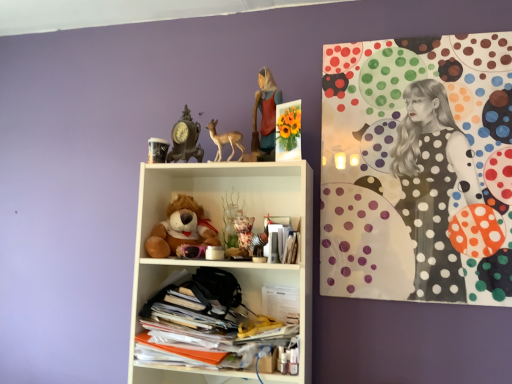
Consider the image. In order to face white paper at center, should I rotate leftwards or rightwards?

It's best to rotate right around 3.828 degrees.

Describe the element at coordinates (281, 242) in the screenshot. The height and width of the screenshot is (384, 512). I see `white paper at center` at that location.

Consider the image. Measure the distance between point (242, 147) and camera.

Point (242, 147) is 1.58 meters away from camera.

What is the approximate width of matte brown deer at upper center?

matte brown deer at upper center is 2.56 inches wide.

Describe the element at coordinates (185, 139) in the screenshot. I see `antique clock at upper center` at that location.

This screenshot has height=384, width=512. What do you see at coordinates (417, 170) in the screenshot?
I see `polka dot fabric at upper right` at bounding box center [417, 170].

Where is `matte red dress at upper center`? The width and height of the screenshot is (512, 384). matte red dress at upper center is located at coordinates (265, 115).

Does soft brown plush at center turn towards white paper at center?

No, soft brown plush at center does not turn towards white paper at center.

Is point (177, 246) in front of point (274, 250)?

No.

The height and width of the screenshot is (384, 512). What are the coordinates of `teddy bear that is on the left side of white paper at center` in the screenshot? It's located at (182, 231).

Does soft brown plush at center have a greater height compared to white paper at center?

Indeed, soft brown plush at center has a greater height compared to white paper at center.

Is the position of stacked papers at lower center, marked as the second shelf in a top-to-bottom arrangement, more distant than that of white plastic shelf at center, positioned as the second shelf in bottom-to-top order?

Yes, the depth of stacked papers at lower center, marked as the second shelf in a top-to-bottom arrangement, is greater than that of white plastic shelf at center, positioned as the second shelf in bottom-to-top order.

I want to click on shelf in front of the stacked papers at lower center, marked as the second shelf in a top-to-bottom arrangement, so click(225, 260).

Who is smaller, stacked papers at lower center, marked as the second shelf in a top-to-bottom arrangement, or white plastic shelf at center, which is the 1th shelf from top to bottom?

stacked papers at lower center, marked as the second shelf in a top-to-bottom arrangement, is smaller.

From a real-world perspective, between stacked papers at lower center, which ranks as the 1th shelf in bottom-to-top order, and white plastic shelf at center, positioned as the second shelf in bottom-to-top order, who is vertically higher?

white plastic shelf at center, positioned as the second shelf in bottom-to-top order, is physically above.

From the image's perspective, is polka dot fabric at upper right above or below matte red dress at upper center?

polka dot fabric at upper right is situated lower than matte red dress at upper center in the image.

Which of these two, polka dot fabric at upper right or matte red dress at upper center, is smaller?

matte red dress at upper center.

Is polka dot fabric at upper right turned away from matte red dress at upper center?

No, matte red dress at upper center is not at the back of polka dot fabric at upper right.

Which is behind, point (139, 328) or point (270, 109)?

The point (139, 328) is more distant.

Considering the sizes of objects white plastic shelf at center, positioned as the second shelf in bottom-to-top order, and matte red dress at upper center in the image provided, who is thinner, white plastic shelf at center, positioned as the second shelf in bottom-to-top order, or matte red dress at upper center?

With smaller width is matte red dress at upper center.

Which of these two, white plastic shelf at center, positioned as the second shelf in bottom-to-top order, or matte red dress at upper center, stands taller?

Standing taller between the two is white plastic shelf at center, positioned as the second shelf in bottom-to-top order.

Measure the distance from white plastic shelf at center, which is the 1th shelf from top to bottom, to matte red dress at upper center.

The distance of white plastic shelf at center, which is the 1th shelf from top to bottom, from matte red dress at upper center is 36.40 centimeters.

How many degrees apart are the facing directions of polka dot fabric at upper right and white plastic shelf at center, which is the 1th shelf from top to bottom?

The facing directions of polka dot fabric at upper right and white plastic shelf at center, which is the 1th shelf from top to bottom, are 0.00171 degrees apart.

Considering the relative sizes of polka dot fabric at upper right and white plastic shelf at center, which is the 1th shelf from top to bottom, in the image provided, is polka dot fabric at upper right wider than white plastic shelf at center, which is the 1th shelf from top to bottom,?

No.

Which object is more forward, polka dot fabric at upper right or white plastic shelf at center, which is the 1th shelf from top to bottom?

white plastic shelf at center, which is the 1th shelf from top to bottom, is closer to the camera.

Which point is more distant from viewer, [441,94] or [280,204]?

The point [280,204] is farther.

Is white plastic shelf at center, which is the 1th shelf from top to bottom, to the left of white paper at center from the viewer's perspective?

Yes.

Can you confirm if white plastic shelf at center, which is the 1th shelf from top to bottom, is wider than white paper at center?

Yes.

From a real-world perspective, count 1st shelfs downward from the white paper at center and point to it. Please provide its 2D coordinates.

[(225, 260)]

Based on the photo, is white plastic shelf at center, which is the 1th shelf from top to bottom, far from white paper at center?

No, white plastic shelf at center, which is the 1th shelf from top to bottom, is not far away from white paper at center.

Is soft brown plush at center smaller than antique clock at upper center?

No, soft brown plush at center is not smaller than antique clock at upper center.

From the image's perspective, which object appears higher, soft brown plush at center or antique clock at upper center?

antique clock at upper center is shown above in the image.

Between soft brown plush at center and antique clock at upper center, which one is positioned behind?

antique clock at upper center.

Could you tell me if soft brown plush at center is turned towards antique clock at upper center?

No, soft brown plush at center is not facing towards antique clock at upper center.

In order to click on teddy bear to the left of white paper at center in this screenshot , I will do `click(182, 231)`.

The image size is (512, 384). I want to click on shelf below the white plastic shelf at center, which is the 1th shelf from top to bottom (from a real-world perspective), so click(243, 302).

When comparing their distances from white plastic shelf at center, which is the 1th shelf from top to bottom, does soft brown plush at center or polka dot fabric at upper right seem further?

polka dot fabric at upper right lies further to white plastic shelf at center, which is the 1th shelf from top to bottom, than the other object.

Based on their spatial positions, is soft brown plush at center or stacked papers at lower center, marked as the second shelf in a top-to-bottom arrangement, closer to white paper at center?

The object closer to white paper at center is stacked papers at lower center, marked as the second shelf in a top-to-bottom arrangement.

Considering their positions, is matte red dress at upper center positioned closer to matte brown deer at upper center than soft brown plush at center?

The object closer to matte brown deer at upper center is matte red dress at upper center.

Which object lies further to the anchor point soft brown plush at center, antique clock at upper center or polka dot fabric at upper right?

Among the two, polka dot fabric at upper right is located further to soft brown plush at center.

Looking at the image, which one is located further to antique clock at upper center, polka dot fabric at upper right or matte brown deer at upper center?

The object further to antique clock at upper center is polka dot fabric at upper right.

Which object lies further to the anchor point matte red dress at upper center, stacked papers at lower center, which ranks as the 1th shelf in bottom-to-top order, or white plastic shelf at center, positioned as the second shelf in bottom-to-top order?

The object further to matte red dress at upper center is stacked papers at lower center, which ranks as the 1th shelf in bottom-to-top order.

Estimate the real-world distances between objects in this image. Which object is closer to matte brown deer at upper center, white plastic shelf at center, which is the 1th shelf from top to bottom, or polka dot fabric at upper right?

white plastic shelf at center, which is the 1th shelf from top to bottom, is positioned closer to the anchor matte brown deer at upper center.

Based on their spatial positions, is white paper at center or stacked papers at lower center, marked as the second shelf in a top-to-bottom arrangement, further from white plastic shelf at center, which is the 1th shelf from top to bottom?

Among the two, white paper at center is located further to white plastic shelf at center, which is the 1th shelf from top to bottom.

Find the location of a particular element. This screenshot has width=512, height=384. magazine located between stacked papers at lower center, which ranks as the 1th shelf in bottom-to-top order, and polka dot fabric at upper right in the left-right direction is located at coordinates (281, 242).

Locate an element on the screen. Image resolution: width=512 pixels, height=384 pixels. magazine between matte red dress at upper center and white plastic shelf at center, which is the 1th shelf from top to bottom, in the up-down direction is located at coordinates (281, 242).

What are the coordinates of `toy between matte red dress at upper center and white paper at center in the up-down direction` in the screenshot? It's located at (225, 140).

Find the location of `magazine between matte brown deer at upper center and white plastic shelf at center, positioned as the second shelf in bottom-to-top order, in the vertical direction`. magazine between matte brown deer at upper center and white plastic shelf at center, positioned as the second shelf in bottom-to-top order, in the vertical direction is located at coordinates coord(281,242).